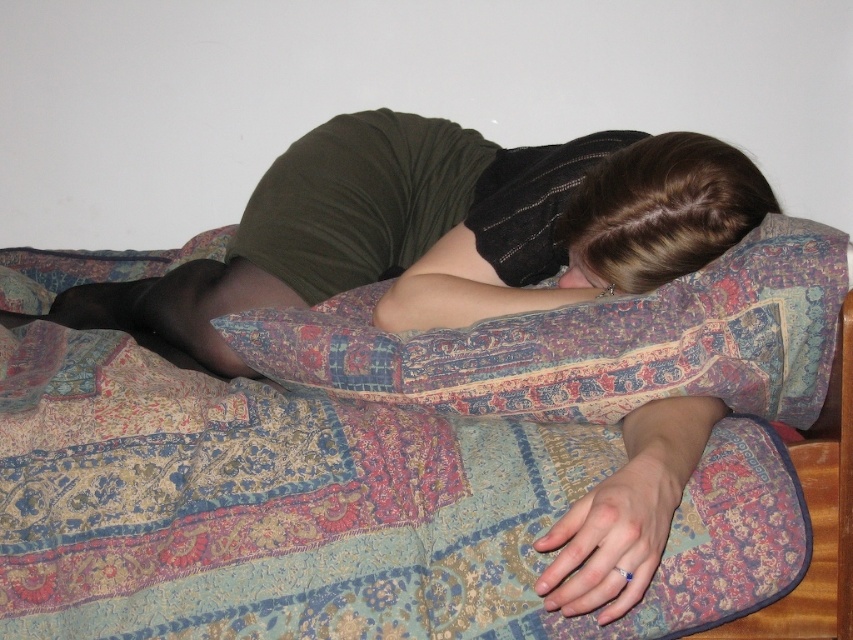
You are designing a poster and need to know the relative sizes of the objects in the image. Which object is bigger, the matte green shirt at center or the brown hair at upper center?

The matte green shirt at center has a larger size compared to the brown hair at upper center, so the matte green shirt at center is bigger.